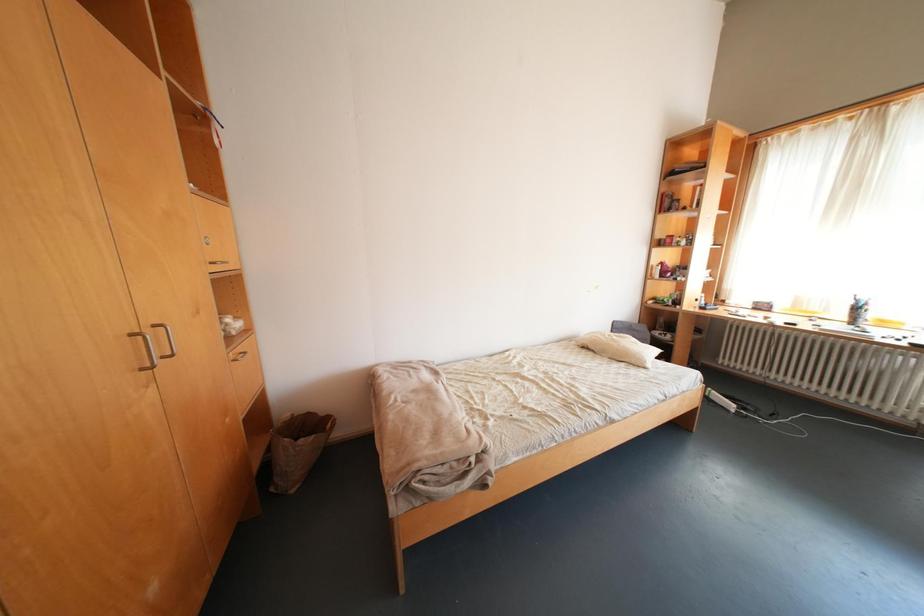
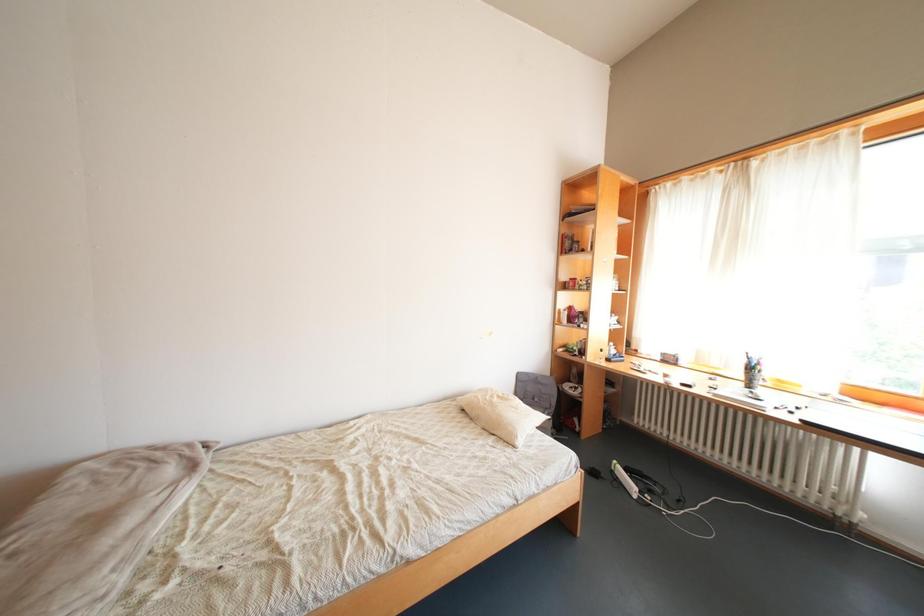
What movement of the cameraman would produce the second image?

The cameraman moved toward right, forward.